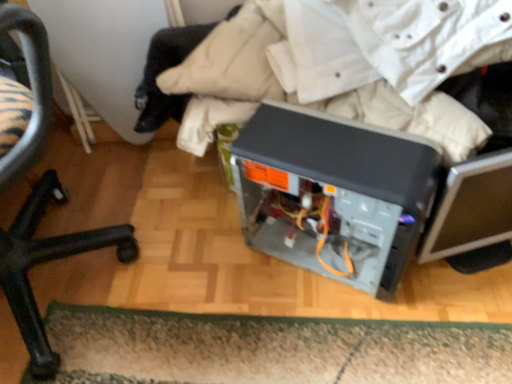
The image size is (512, 384). What are the coordinates of `vacant space that's between black plastic chair at lower left and satin black computer case at center` in the screenshot? It's located at (220, 304).